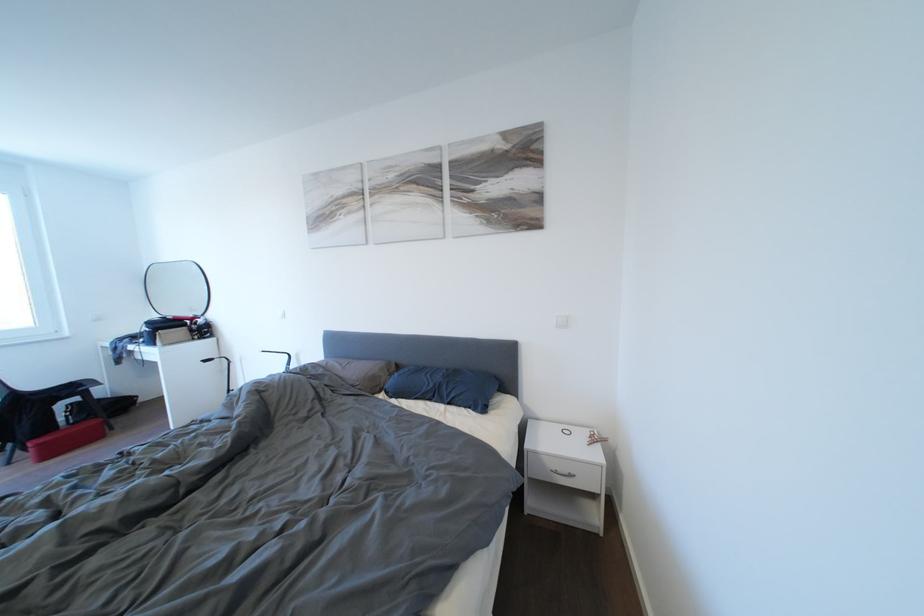
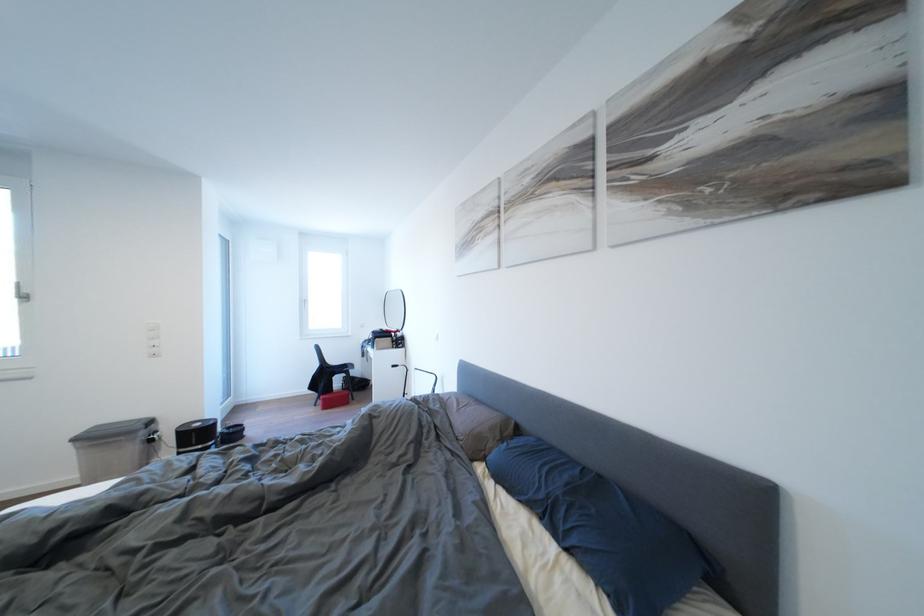
Question: The camera is either moving clockwise (left) or counter-clockwise (right) around the object. The first image is from the beginning of the video and the second image is from the end. Is the camera moving left or right when shooting the video?

Choices:
 (A) Left
 (B) Right

Answer: (B)